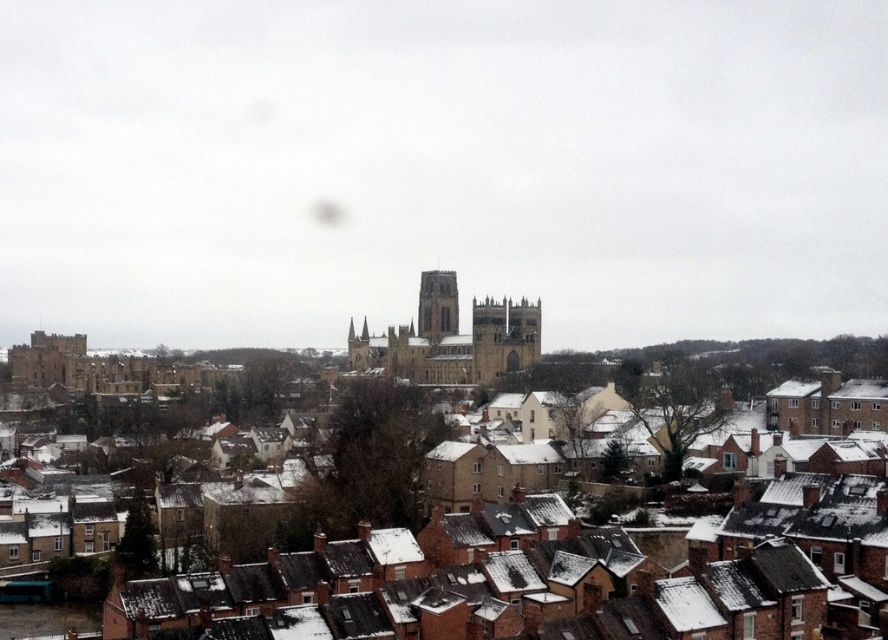
Question: Which point is closer to the camera taking this photo?

Choices:
 (A) (408, 449)
 (B) (432, 282)

Answer: (A)

Question: Where is brown brick houses at lower center located in relation to brown stone tower at center in the image?

Choices:
 (A) above
 (B) below

Answer: (B)

Question: Can you confirm if brown brick houses at lower center is positioned below brown stone tower at center?

Choices:
 (A) no
 (B) yes

Answer: (B)

Question: Is brown brick houses at lower center to the left of brown stone tower at center from the viewer's perspective?

Choices:
 (A) no
 (B) yes

Answer: (A)

Question: Which object is farther from the camera taking this photo?

Choices:
 (A) brown stone tower at center
 (B) brown brick houses at lower center

Answer: (A)